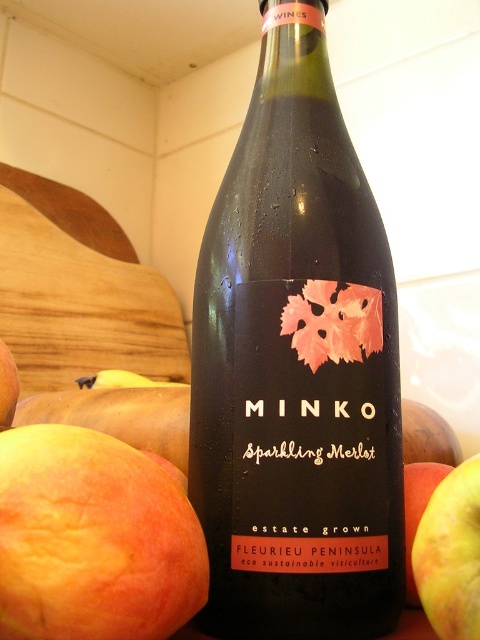
You are a customer at a grocery store looking at the Minko Sparkling Merlot wine bottle. You also see a ripe peach at lower left and a smooth yellow apple at right. If you want to buy the fruit that is bigger, which one should you choose?

The ripe peach at lower left is larger in size than the smooth yellow apple at right, so you should choose the ripe peach at lower left.

You are arranging fruits on a table for a photo shoot. You have a ripe peach at lower left and a yellow matte apple at lower right. The photographer wants to know which fruit is wider. Which one should you point out?

The ripe peach at lower left is wider than the yellow matte apple at lower right.